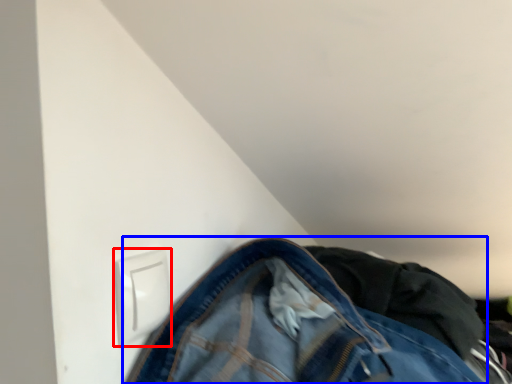
Question: Which of the following is the closest to the observer, electric outlet (highlighted by a red box) or trousers (highlighted by a blue box)?

Choices:
 (A) electric outlet
 (B) trousers

Answer: (A)